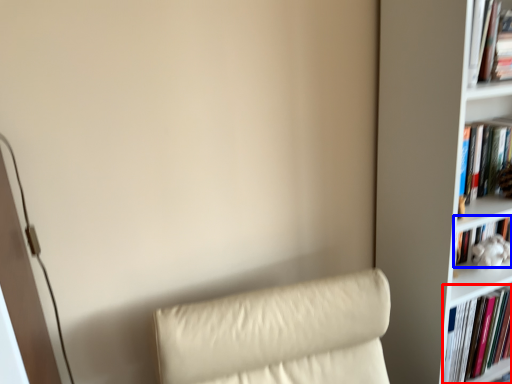
Question: Which of the following is the closest to the observer, book (highlighted by a red box) or book (highlighted by a blue box)?

Choices:
 (A) book
 (B) book

Answer: (A)